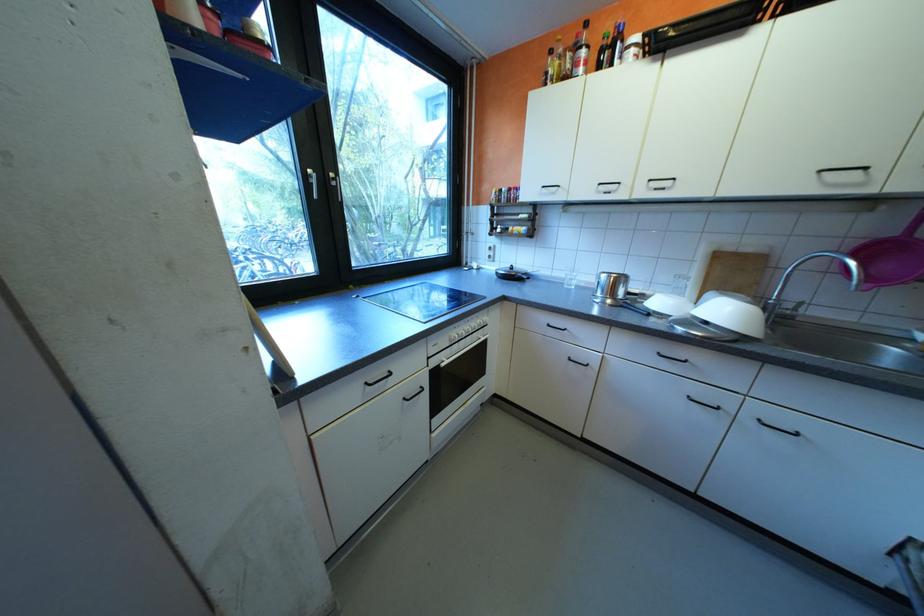
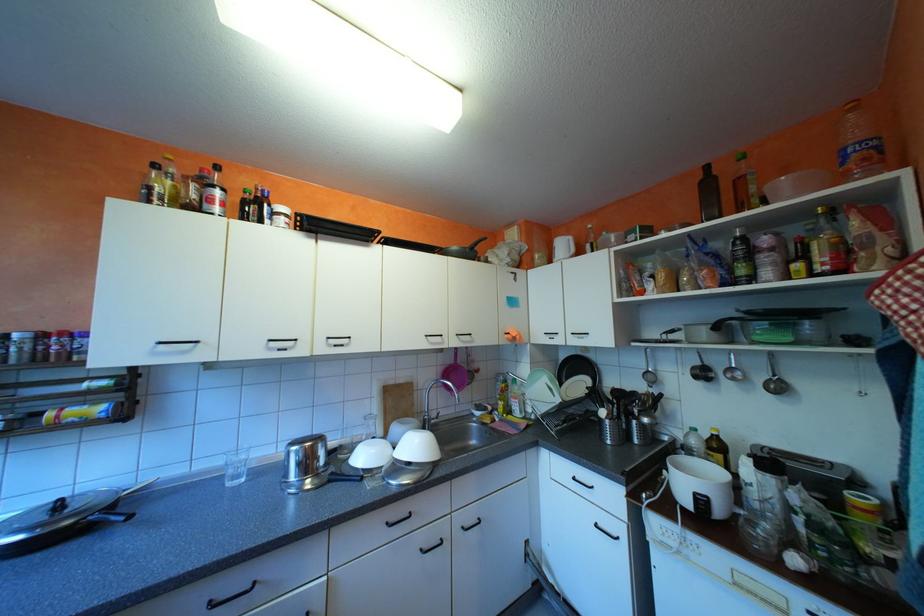
In the second image, find the point that corresponds to point (598, 71) in the first image.

(237, 214)